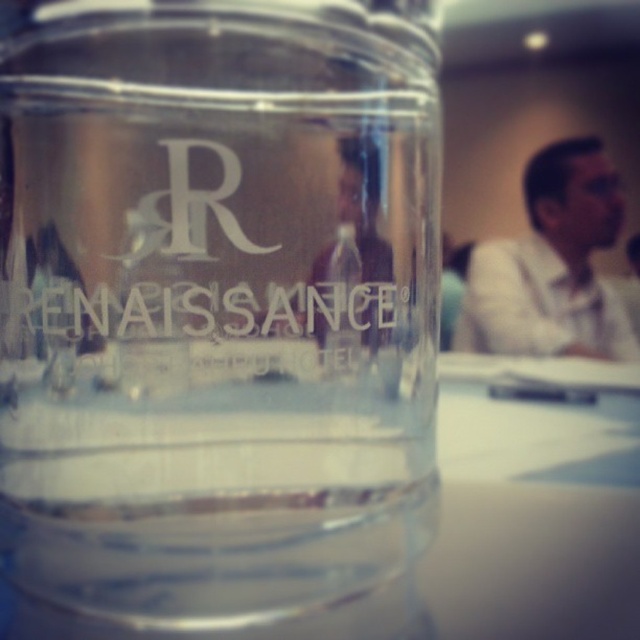
You are organizing a small event and have both a transparent glass jar at center and a transparent glass at center on your table. Which one is narrower?

The transparent glass jar at center is narrower than the transparent glass at center as it has a lesser width.